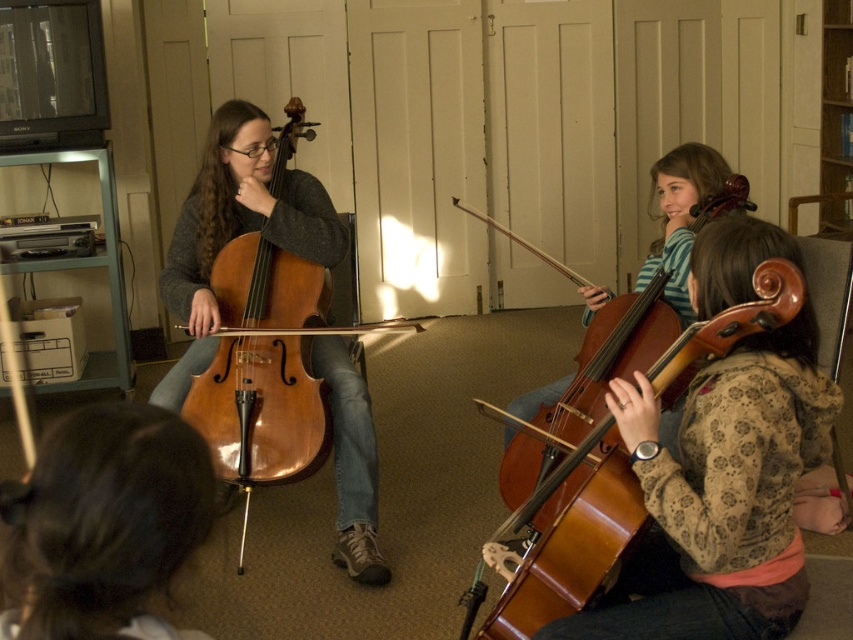
Question: Among these points, which one is nearest to the camera?

Choices:
 (A) (792, 307)
 (B) (256, 232)
 (C) (664, 342)
 (D) (96, 570)

Answer: (D)

Question: Is shiny brown wood cello at left further to the viewer compared to wooden bookshelf at upper right?

Choices:
 (A) yes
 (B) no

Answer: (B)

Question: Is wooden violin at center thinner than wooden polished cello at center?

Choices:
 (A) yes
 (B) no

Answer: (A)

Question: Which of the following is the closest to the observer?

Choices:
 (A) wooden bookshelf at upper right
 (B) shiny brown wood cello at left
 (C) wooden polished cello at center
 (D) black hair at lower left

Answer: (D)

Question: Estimate the real-world distances between objects in this image. Which object is closer to the wooden violin at center?

Choices:
 (A) black hair at lower left
 (B) wooden bookshelf at upper right

Answer: (A)

Question: From the image, what is the correct spatial relationship of wooden violin at center in relation to shiny brown wood cello at left?

Choices:
 (A) below
 (B) above

Answer: (A)